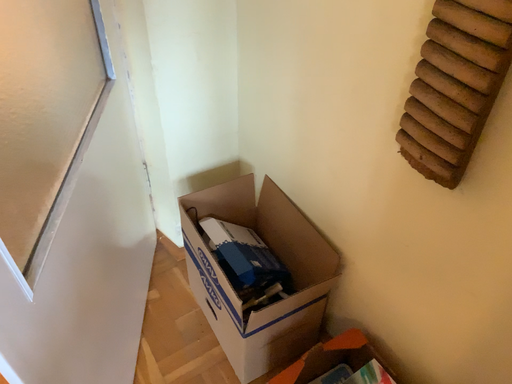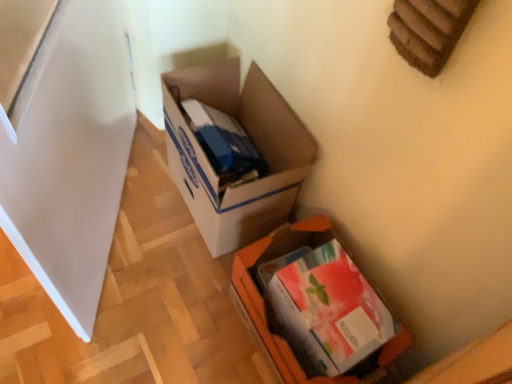
Question: Which way did the camera rotate in the video?

Choices:
 (A) rotated upward
 (B) rotated downward

Answer: (B)